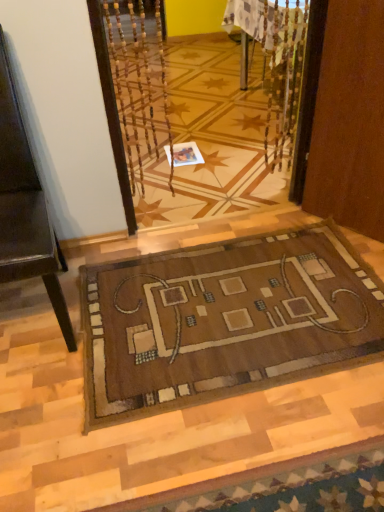
This screenshot has height=512, width=384. Find the location of `free spot above brown woven mat at center (from a real-world perspective)`. free spot above brown woven mat at center (from a real-world perspective) is located at coordinates (227, 302).